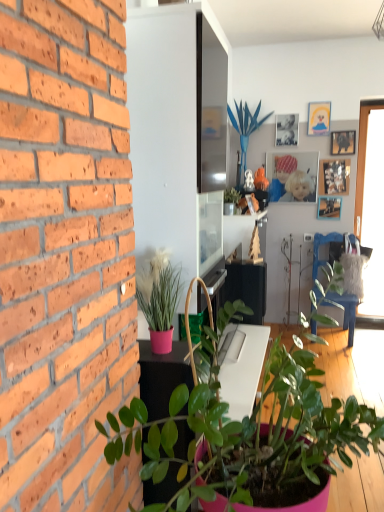
Question: In terms of width, does pink matte plant at left, the 2th houseplant when ordered from bottom to top, look wider or thinner when compared to green glossy plant at upper center, placed as the 2th houseplant when sorted from back to front?

Choices:
 (A) thin
 (B) wide

Answer: (B)

Question: Choose the correct answer: Is pink matte plant at left, which is the 3th houseplant from back to front, inside green glossy plant at upper center, positioned as the second houseplant in top-to-bottom order, or outside it?

Choices:
 (A) inside
 (B) outside

Answer: (B)

Question: Which object is the closest to the blue artificial plant at center, placed as the first houseplant when sorted from top to bottom?

Choices:
 (A) blue plastic chair at right
 (B) green matte plant at lower center, which is the 4th houseplant from back to front
 (C) wooden picture frame at upper right, the fourth picture frame in the bottom-to-top sequence
 (D) transparent glass window at right
 (E) matte silver photo frame at upper center, arranged as the second picture frame when viewed from the top

Answer: (E)

Question: Estimate the real-world distances between objects in this image. Which object is farther from the blue artificial plant at center, acting as the 1th houseplant starting from the back?

Choices:
 (A) wooden photo frame at upper right, which appears as the 2th picture frame when ordered from the bottom
 (B) green matte plant at lower center, marked as the fourth houseplant in a top-to-bottom arrangement
 (C) matte wooden picture frame at upper right, the sixth picture frame in the bottom-to-top sequence
 (D) matte silver photo frame at upper center, which is the 5th picture frame from bottom to top
 (E) blue plastic chair at right

Answer: (B)